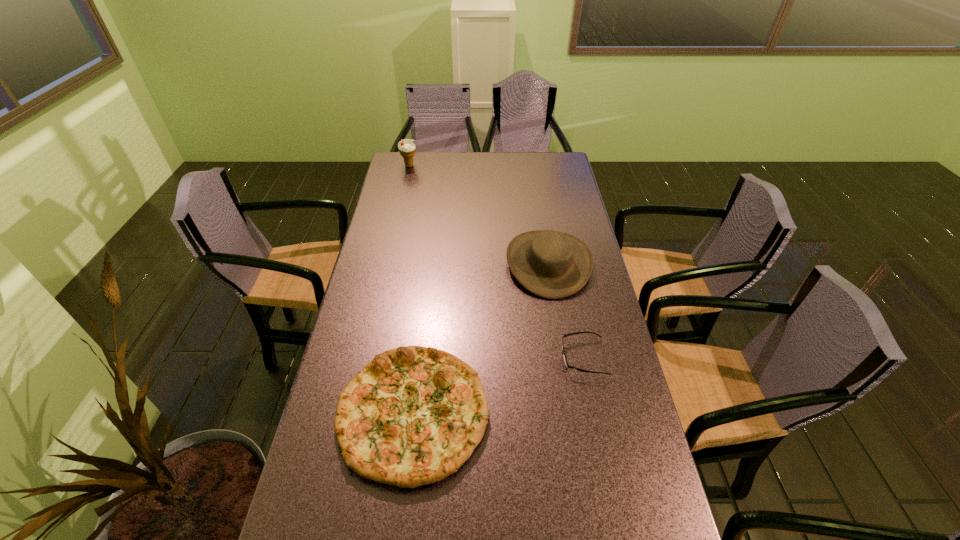
Where is `the tallest object`? The width and height of the screenshot is (960, 540). the tallest object is located at coordinates (406, 147).

This screenshot has height=540, width=960. I want to click on icecream, so click(406, 147).

I want to click on cowboy hat, so click(x=550, y=264).

In order to click on the second farthest object in this screenshot , I will do `click(550, 264)`.

Locate an element on the screen. pizza is located at coordinates (412, 416).

I want to click on the shortest object, so click(x=567, y=365).

You are a GUI agent. You are given a task and a screenshot of the screen. Output one action in this format:
    pyautogui.click(x=<x>, y=<y>)
    Task: Click on the free space located 0.180m on the front of the icecream
    
    Given the screenshot: What is the action you would take?
    pyautogui.click(x=403, y=192)

The width and height of the screenshot is (960, 540). Identify the location of free region located on the back of the second tallest object. (535, 184).

Identify the location of free space located 0.290m on the back of the pizza. (429, 280).

Identify the location of vacant region located on the front-facing side of the sunglasses. (485, 357).